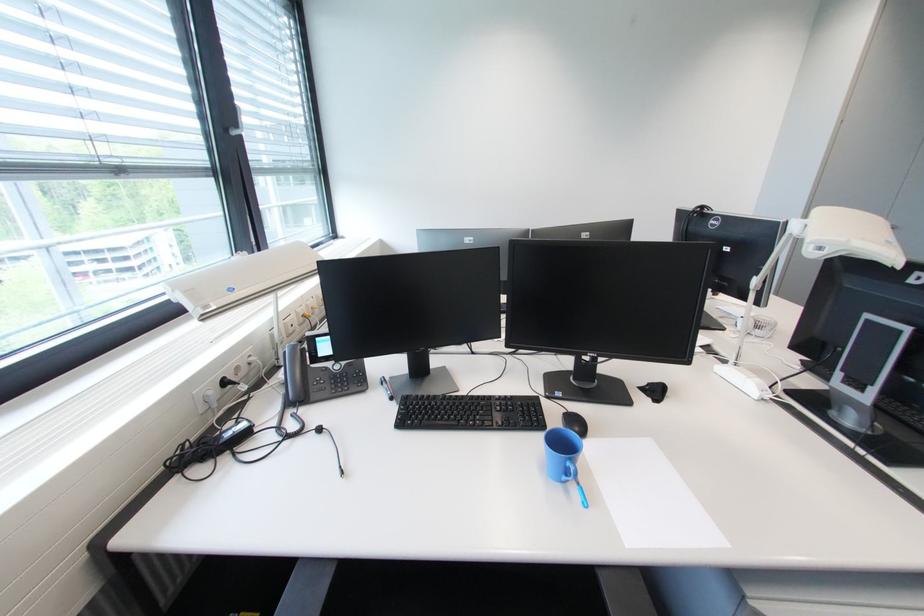
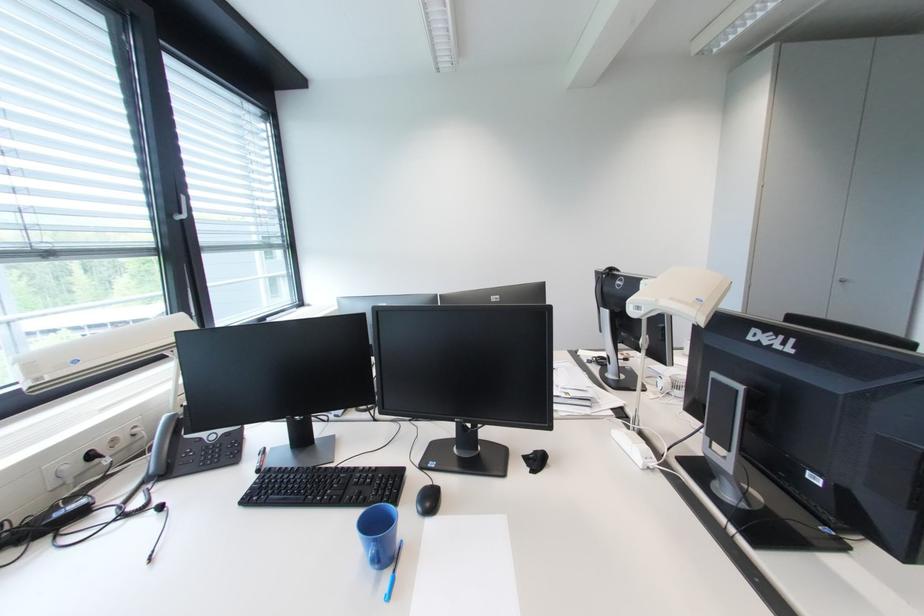
Find the pixel in the second image that matches the point at 276,390 in the first image.

(151, 464)